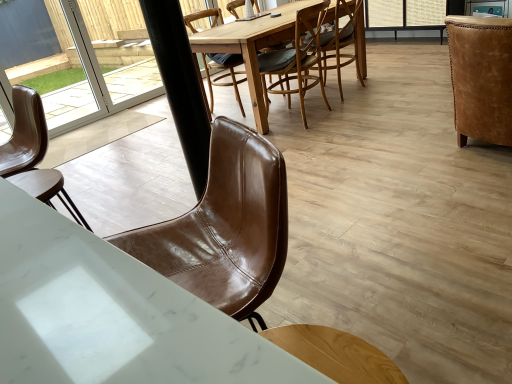
Question: Is wooden round table at center closer to the viewer compared to leather armchair at right, the 1th chair viewed from the right?

Choices:
 (A) no
 (B) yes

Answer: (A)

Question: Could you tell me if wooden round table at center is facing leather armchair at right, placed as the 5th chair when sorted from left to right?

Choices:
 (A) yes
 (B) no

Answer: (B)

Question: Is wooden round table at center thinner than leather armchair at right, the 1th chair viewed from the right?

Choices:
 (A) no
 (B) yes

Answer: (B)

Question: Does wooden round table at center contain leather armchair at right, the 1th chair viewed from the right?

Choices:
 (A) no
 (B) yes

Answer: (A)

Question: From the image's perspective, is wooden round table at center above leather armchair at right, the 1th chair viewed from the right?

Choices:
 (A) no
 (B) yes

Answer: (B)

Question: In terms of size, does leather armchair at right, the 1th chair viewed from the right, appear bigger or smaller than brown leather chair at left, arranged as the first chair when viewed from the left?

Choices:
 (A) small
 (B) big

Answer: (B)

Question: Relative to brown leather chair at left, placed as the 5th chair when sorted from right to left, is leather armchair at right, the 1th chair viewed from the right, in front or behind?

Choices:
 (A) front
 (B) behind

Answer: (B)

Question: From the image's perspective, relative to brown leather chair at left, placed as the 5th chair when sorted from right to left, is leather armchair at right, the 1th chair viewed from the right, above or below?

Choices:
 (A) above
 (B) below

Answer: (A)

Question: Based on their positions, is leather armchair at right, the 1th chair viewed from the right, located to the left or right of brown leather chair at left, placed as the 5th chair when sorted from right to left?

Choices:
 (A) right
 (B) left

Answer: (A)

Question: From a real-world perspective, is black matte pole at center above or below brown leather chair at center, positioned as the 4th chair in right-to-left order?

Choices:
 (A) below
 (B) above

Answer: (A)

Question: Is black matte pole at center inside or outside of brown leather chair at center, the second chair from the left?

Choices:
 (A) outside
 (B) inside

Answer: (A)

Question: From the image's perspective, is black matte pole at center located above or below brown leather chair at center, the second chair from the left?

Choices:
 (A) above
 (B) below

Answer: (B)

Question: In the image, is black matte pole at center positioned in front of or behind brown leather chair at center, the second chair from the left?

Choices:
 (A) behind
 (B) front

Answer: (B)

Question: From the image's perspective, is white marble desk at lower left positioned above or below transparent glass door at upper left?

Choices:
 (A) below
 (B) above

Answer: (A)

Question: In terms of width, does white marble desk at lower left look wider or thinner when compared to transparent glass door at upper left?

Choices:
 (A) thin
 (B) wide

Answer: (B)